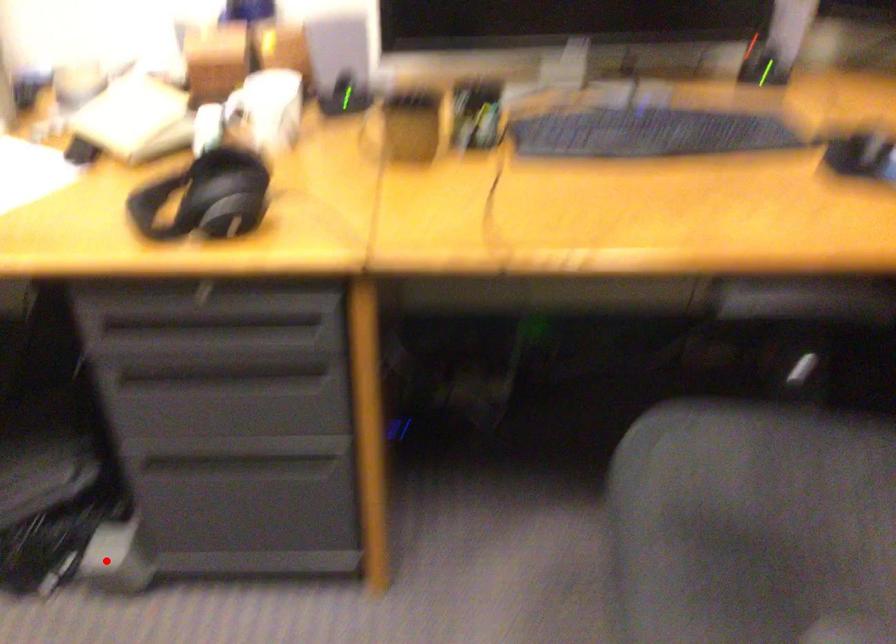
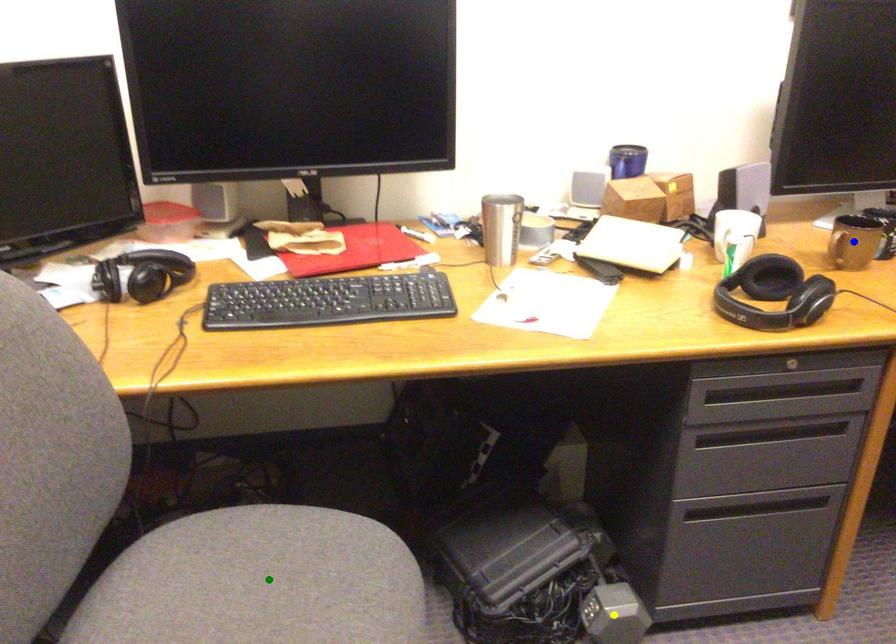
Question: I am providing you with two images of the same scene from different viewpoints. A red point is marked on the first image. You are given multiple points on the second image. In image 2, which mark is for the same physical point as the one in image 1?

Choices:
 (A) yellow point
 (B) green point
 (C) blue point

Answer: (A)